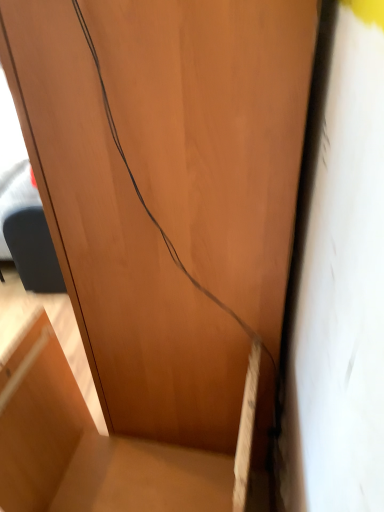
Question: Is matte wood cabinet at center bigger or smaller than brown matte wire at center?

Choices:
 (A) small
 (B) big

Answer: (A)

Question: Looking at their shapes, would you say matte wood cabinet at center is wider or thinner than brown matte wire at center?

Choices:
 (A) wide
 (B) thin

Answer: (B)

Question: Considering their positions, is matte wood cabinet at center located in front of or behind brown matte wire at center?

Choices:
 (A) front
 (B) behind

Answer: (B)

Question: Does point (175, 260) appear closer or farther from the camera than point (8, 381)?

Choices:
 (A) closer
 (B) farther

Answer: (A)

Question: From the image's perspective, is brown matte wire at center positioned above or below matte wood cabinet at center?

Choices:
 (A) below
 (B) above

Answer: (B)

Question: Considering the positions of brown matte wire at center and matte wood cabinet at center in the image, is brown matte wire at center wider or thinner than matte wood cabinet at center?

Choices:
 (A) wide
 (B) thin

Answer: (A)

Question: Is brown matte wire at center in front of or behind matte wood cabinet at center in the image?

Choices:
 (A) behind
 (B) front

Answer: (B)